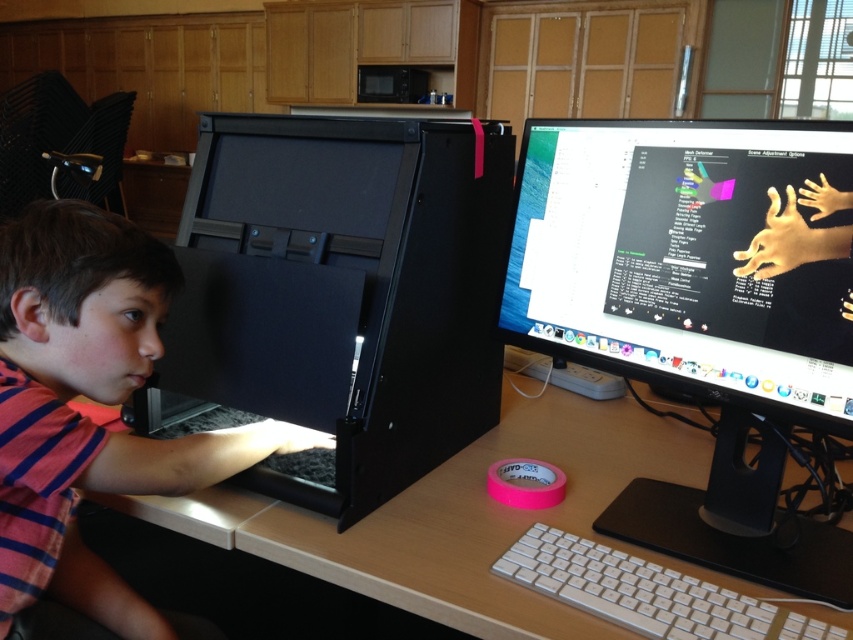
Who is positioned more to the right, matte black monitor at center or white plastic keyboard at lower center?

From the viewer's perspective, white plastic keyboard at lower center appears more on the right side.

Is point (26, 406) closer to camera compared to point (567, 566)?

That is True.

Locate an element on the screen. The height and width of the screenshot is (640, 853). matte black monitor at center is located at coordinates (91, 400).

Which is more to the left, black plastic monitor at center or black matte computer at left?

black matte computer at left

From the picture: Is black plastic monitor at center to the left of black matte computer at left from the viewer's perspective?

In fact, black plastic monitor at center is to the right of black matte computer at left.

This screenshot has width=853, height=640. Describe the element at coordinates (700, 310) in the screenshot. I see `black plastic monitor at center` at that location.

You are a GUI agent. You are given a task and a screenshot of the screen. Output one action in this format:
    pyautogui.click(x=<x>, y=<y>)
    Task: Click on the black plastic monitor at center
    The width and height of the screenshot is (853, 640).
    Given the screenshot: What is the action you would take?
    pyautogui.click(x=700, y=310)

Between black plastic monitor at center and matte black monitor at center, which one is positioned higher?

black plastic monitor at center

Who is taller, black plastic monitor at center or matte black monitor at center?

Standing taller between the two is black plastic monitor at center.

Between point (779, 563) and point (19, 353), which one is positioned in front?

Point (19, 353) is in front.

Where is `black plastic monitor at center`? This screenshot has height=640, width=853. black plastic monitor at center is located at coordinates (700, 310).